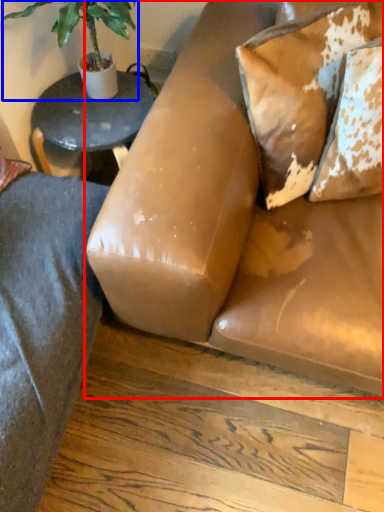
Question: Which of the following is the closest to the observer, studio couch (highlighted by a red box) or houseplant (highlighted by a blue box)?

Choices:
 (A) studio couch
 (B) houseplant

Answer: (A)